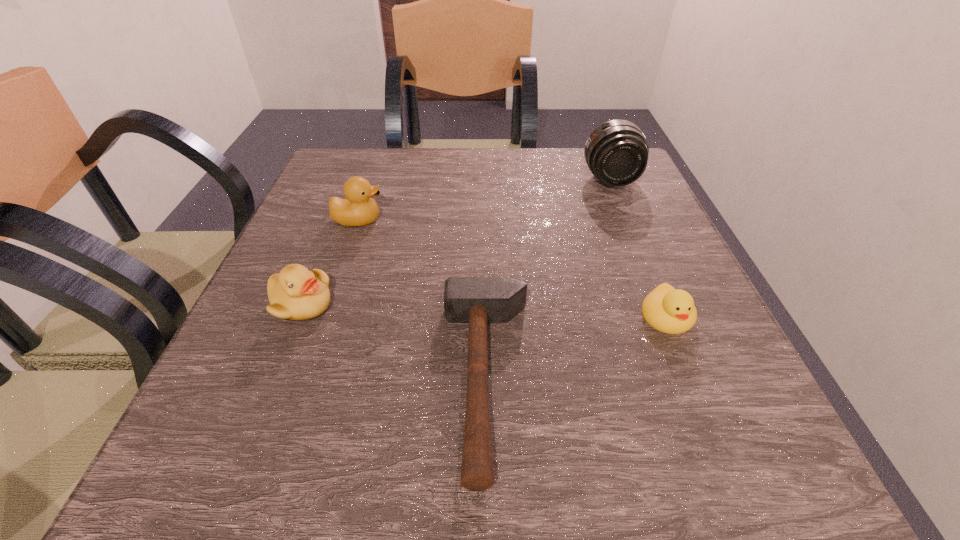
The width and height of the screenshot is (960, 540). Identify the location of the tallest object. (616, 152).

Locate an element on the screen. the farthest object is located at coordinates (616, 152).

At what (x,y) coordinates should I click in order to perform the action: click on the second farthest object. Please return your answer as a coordinate pair (x, y). The height and width of the screenshot is (540, 960). Looking at the image, I should click on (358, 209).

Identify the location of the shortest duckling. Image resolution: width=960 pixels, height=540 pixels. (666, 309).

Find the location of `the rightmost duckling`. the rightmost duckling is located at coordinates click(666, 309).

The width and height of the screenshot is (960, 540). Find the location of `the shortest object`. the shortest object is located at coordinates (475, 300).

The width and height of the screenshot is (960, 540). I want to click on hammer, so click(x=475, y=300).

I want to click on free space located 0.360m at the front element of the farthest object, so pyautogui.click(x=665, y=310).

Find the location of `vacant space situated 0.330m on the face of the farthest duckling`. vacant space situated 0.330m on the face of the farthest duckling is located at coordinates (544, 220).

Locate an element on the screen. This screenshot has width=960, height=540. free space located 0.190m on the face of the second shortest object is located at coordinates (726, 460).